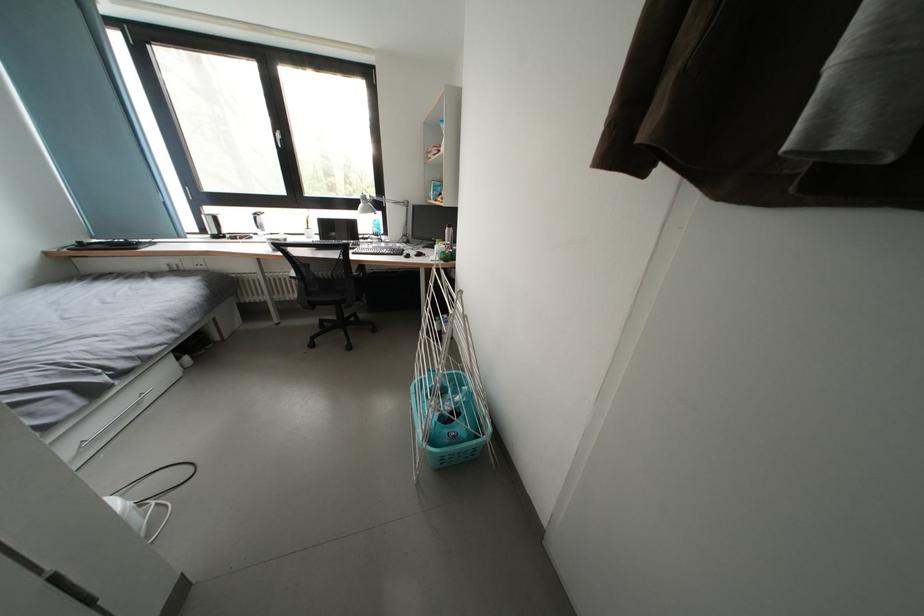
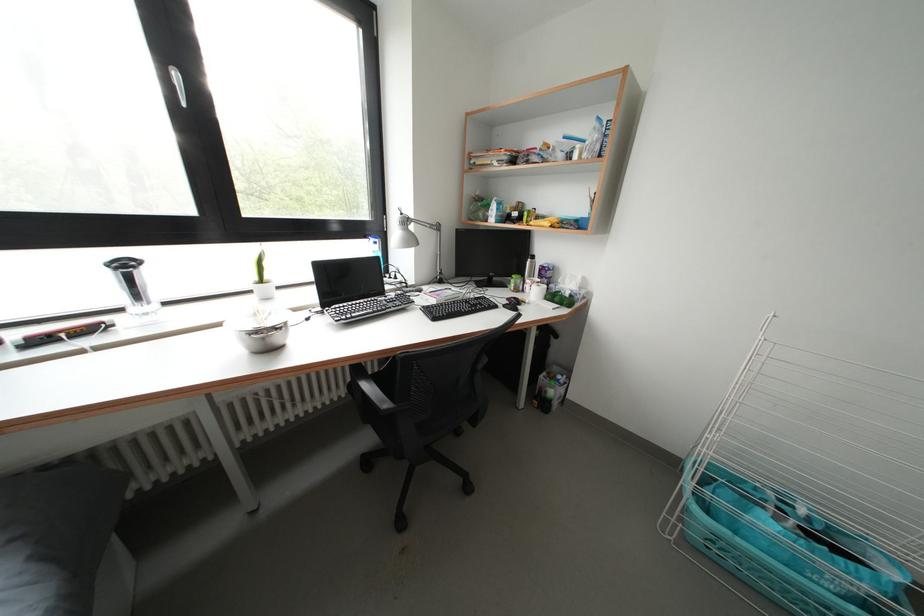
The point at (263, 219) is marked in the first image. Where is the corresponding point in the second image?

(131, 270)